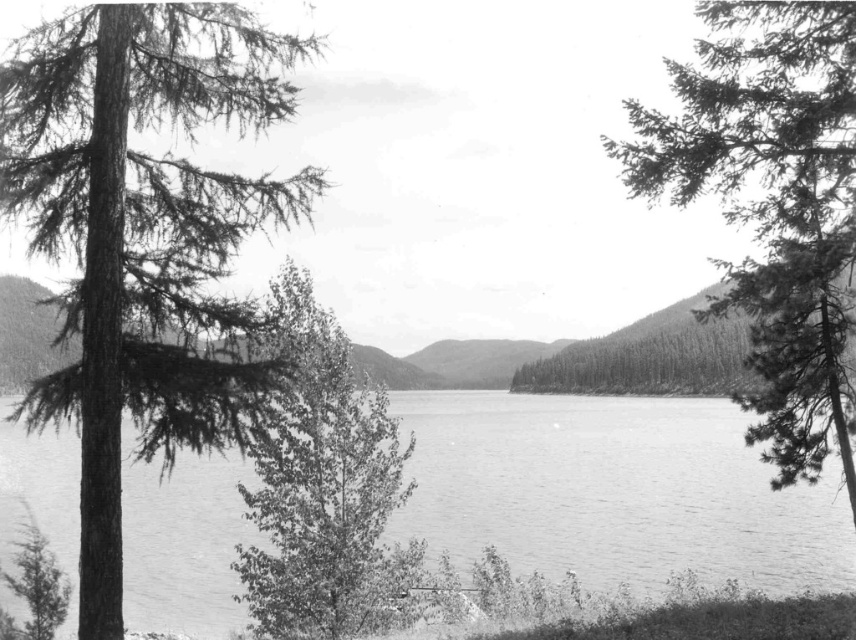
Question: Based on their relative distances, which object is nearer to the dark green textured tree trunk at left?

Choices:
 (A) smooth water at center
 (B) smooth green tree at center

Answer: (B)

Question: Is dark green textured tree trunk at left thinner than needle-like evergreen at right?

Choices:
 (A) yes
 (B) no

Answer: (A)

Question: Does dark green textured tree trunk at left have a smaller size compared to smooth green tree at center?

Choices:
 (A) no
 (B) yes

Answer: (B)

Question: Which point is closer to the camera?

Choices:
 (A) smooth water at center
 (B) dark green textured tree trunk at left
 (C) smooth green tree at center

Answer: (A)

Question: Which point is closer to the camera?

Choices:
 (A) (325, 600)
 (B) (193, 390)

Answer: (B)

Question: Is the position of needle-like evergreen at right less distant than that of smooth green tree at center?

Choices:
 (A) no
 (B) yes

Answer: (B)